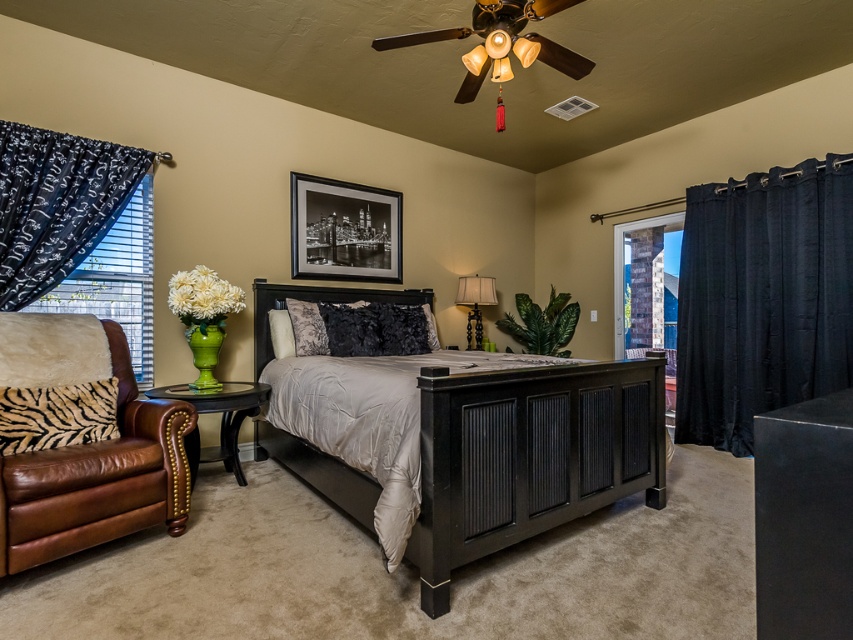
You are a delivery person who needs to place a 8 feet long sofa in the bedroom. The sofa must be placed between the brown leather armchair at lower left and the black matte dresser at center. Is there enough space for the sofa?

The distance between the brown leather armchair at lower left and the black matte dresser at center is 7.94 feet. Since the sofa is 8 feet long, there is not enough space to place it between them.

You are standing at the entrance of the bedroom and want to place a new plant pot at the exact location marked by point (97, 477). Which object is currently occupying that spot?

The brown leather armchair at lower left is represented by point (97, 477), so that spot is currently occupied by the brown leather armchair at lower left.

You are an interior designer planning to place a large painting that measures 1.5 meters wide between the satin black bed at center and the clear glass window at right. Considering their sizes, will the painting fit horizontally between them?

The satin black bed at center is larger in size than the clear glass window at right. Since the painting is 1.5 meters wide, it might not fit if the distance between them is smaller than the painting. However, the description only mentions their size comparison, not the actual distance. Therefore, it is uncertain if the painting will fit without knowing the exact spacing between them.